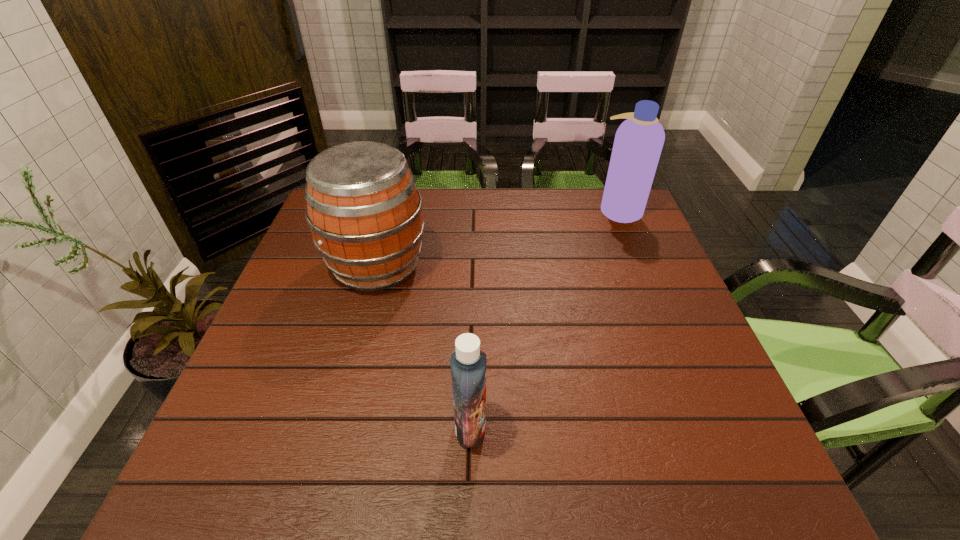
Locate an element on the screen. The image size is (960, 540). object at the near edge is located at coordinates (468, 361).

The image size is (960, 540). What are the coordinates of `object that is at the left edge` in the screenshot? It's located at (364, 211).

You are a GUI agent. You are given a task and a screenshot of the screen. Output one action in this format:
    pyautogui.click(x=<x>, y=<y>)
    Task: Click on the object that is at the right edge
    This screenshot has height=540, width=960.
    Given the screenshot: What is the action you would take?
    pyautogui.click(x=638, y=143)

In order to click on object positioned at the far right corner in this screenshot , I will do `click(638, 143)`.

The width and height of the screenshot is (960, 540). In the image, there is a desktop. What are the coordinates of `vacant space at the far edge` in the screenshot? It's located at (506, 202).

Locate an element on the screen. This screenshot has height=540, width=960. blank area at the near edge is located at coordinates (388, 499).

Locate an element on the screen. Image resolution: width=960 pixels, height=540 pixels. free location at the left edge is located at coordinates (309, 307).

The image size is (960, 540). I want to click on vacant region at the right edge of the desktop, so click(631, 233).

Locate an element on the screen. This screenshot has width=960, height=540. free spot at the near left corner of the desktop is located at coordinates (213, 463).

The width and height of the screenshot is (960, 540). I want to click on vacant area that lies between the second farthest object and the shortest object, so click(x=423, y=346).